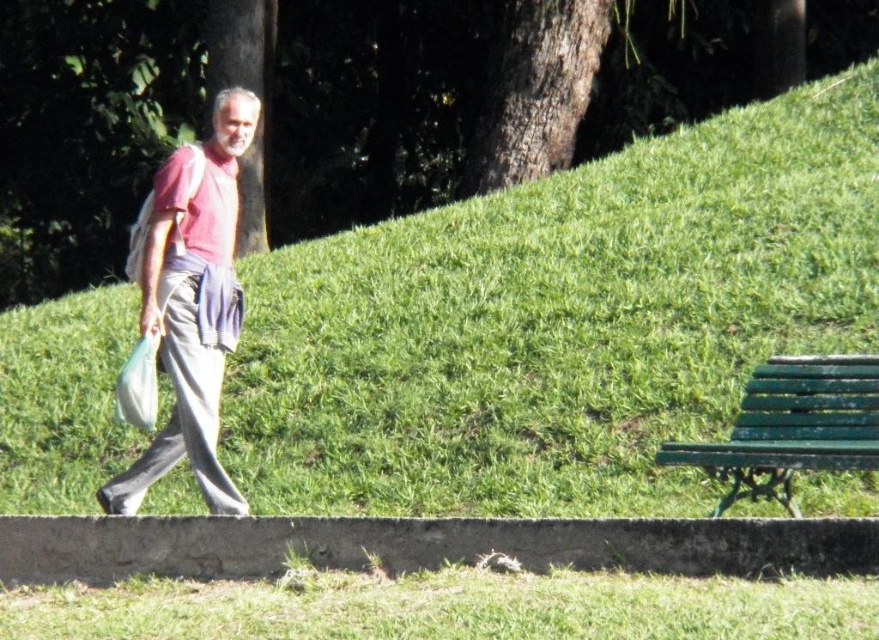
Question: Among these objects, which one is farthest from the camera?

Choices:
 (A) matte red shirt at left
 (B) green grassy at lower center
 (C) green grassy hillside at center

Answer: (C)

Question: Which object appears farthest from the camera in this image?

Choices:
 (A) matte red shirt at left
 (B) green grassy at lower center
 (C) green grassy hillside at center

Answer: (C)

Question: Observing the image, what is the correct spatial positioning of green grassy at lower center in reference to green painted wood bench at lower right?

Choices:
 (A) left
 (B) right

Answer: (A)

Question: Is green grassy hillside at center closer to camera compared to green grassy at lower center?

Choices:
 (A) no
 (B) yes

Answer: (A)

Question: Is matte red shirt at left smaller than green painted wood bench at lower right?

Choices:
 (A) yes
 (B) no

Answer: (B)

Question: Which object is farther from the camera taking this photo?

Choices:
 (A) green grassy hillside at center
 (B) green grassy at lower center

Answer: (A)